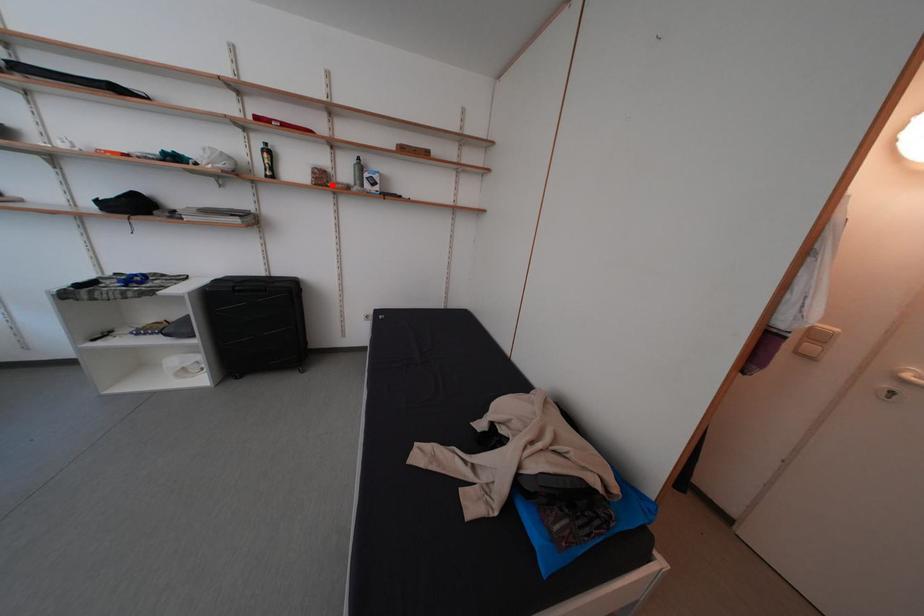
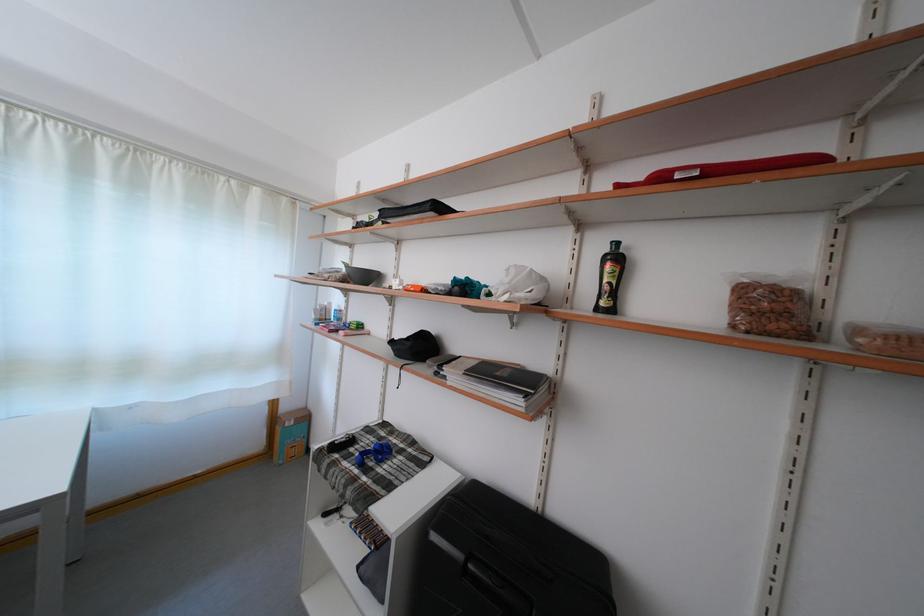
Question: I am providing you with two images of the same scene from different viewpoints. A red point is shown in image1. For the corresponding object point in image2, is it positioned nearer or farther from the camera?

Choices:
 (A) Nearer
 (B) Farther

Answer: (B)